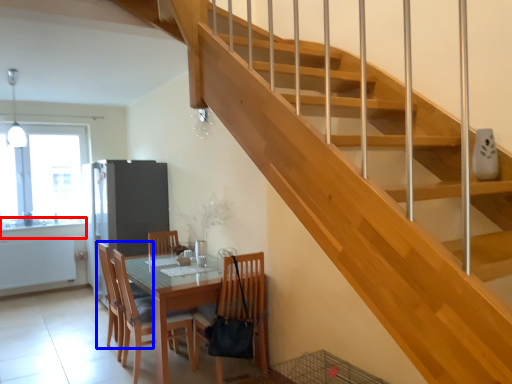
Question: Which object is closer to the camera taking this photo, counter top (highlighted by a red box) or chair (highlighted by a blue box)?

Choices:
 (A) counter top
 (B) chair

Answer: (B)